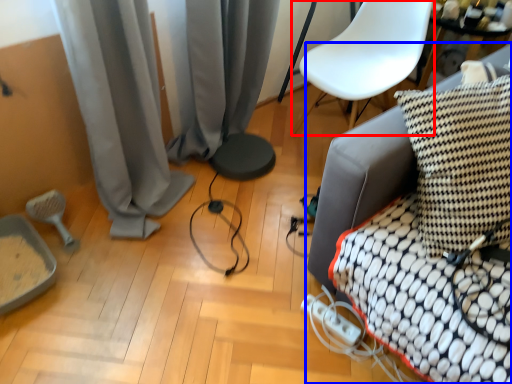
Question: Which of the following is the closest to the observer, armchair (highlighted by a red box) or furniture (highlighted by a blue box)?

Choices:
 (A) armchair
 (B) furniture

Answer: (B)